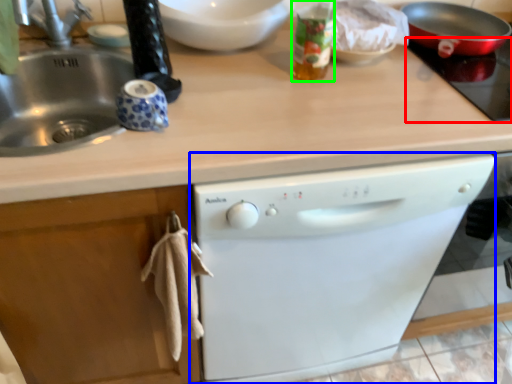
Question: Based on their relative distances, which object is nearer to gas stove (highlighted by a red box)? Choose from dishwasher (highlighted by a blue box) and bottle (highlighted by a green box).

Choices:
 (A) dishwasher
 (B) bottle

Answer: (B)